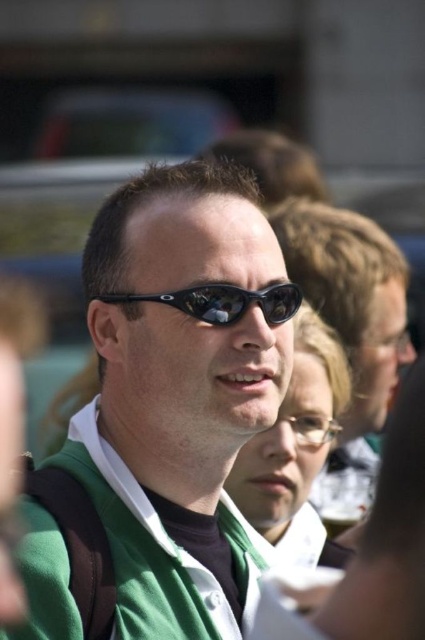
Question: Can you confirm if matte black sunglasses at center is smaller than black plastic sunglasses at center?

Choices:
 (A) yes
 (B) no

Answer: (B)

Question: Among these points, which one is nearest to the camera?

Choices:
 (A) (235, 317)
 (B) (212, 486)

Answer: (A)

Question: Is green matte jacket at center closer to camera compared to black plastic sunglasses at center?

Choices:
 (A) yes
 (B) no

Answer: (A)

Question: Which of the following is the closest to the observer?

Choices:
 (A) green matte jacket at center
 (B) matte black sunglasses at center
 (C) clear glass beer at center
 (D) black plastic sunglasses at center

Answer: (A)

Question: From the image, what is the correct spatial relationship of green matte jacket at center in relation to matte black sunglasses at center?

Choices:
 (A) left
 (B) right

Answer: (A)

Question: Estimate the real-world distances between objects in this image. Which object is closer to the black plastic sunglasses at center?

Choices:
 (A) green matte jacket at center
 (B) clear glass beer at center

Answer: (A)